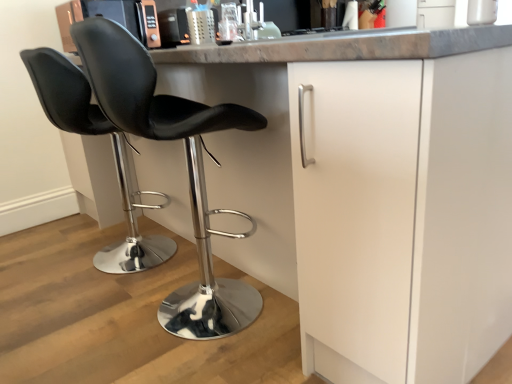
Question: From a real-world perspective, is black leather chair at center, the 2th chair when ordered from right to left, positioned under black leather stool at center, positioned as the 2th chair in left-to-right order, based on gravity?

Choices:
 (A) yes
 (B) no

Answer: (A)

Question: Can you confirm if black leather chair at center, arranged as the first chair when viewed from the left, is smaller than black leather stool at center, which appears as the 1th chair when viewed from the right?

Choices:
 (A) no
 (B) yes

Answer: (B)

Question: Is black leather chair at center, arranged as the first chair when viewed from the left, not close to black leather stool at center, which appears as the 1th chair when viewed from the right?

Choices:
 (A) no
 (B) yes

Answer: (A)

Question: From the image's perspective, is black leather chair at center, arranged as the first chair when viewed from the left, above black leather stool at center, positioned as the 2th chair in left-to-right order?

Choices:
 (A) no
 (B) yes

Answer: (B)

Question: Would you say black leather stool at center, positioned as the 2th chair in left-to-right order, is part of black leather chair at center, arranged as the first chair when viewed from the left,'s contents?

Choices:
 (A) yes
 (B) no

Answer: (B)

Question: Is black leather chair at center, the 2th chair when ordered from right to left, oriented towards black leather stool at center, positioned as the 2th chair in left-to-right order?

Choices:
 (A) no
 (B) yes

Answer: (A)

Question: Is the depth of black leather stool at center, positioned as the 2th chair in left-to-right order, less than that of black leather chair at center, arranged as the first chair when viewed from the left?

Choices:
 (A) yes
 (B) no

Answer: (A)

Question: Can you confirm if black leather stool at center, positioned as the 2th chair in left-to-right order, is positioned to the right of black leather chair at center, arranged as the first chair when viewed from the left?

Choices:
 (A) yes
 (B) no

Answer: (A)

Question: Is black leather stool at center, positioned as the 2th chair in left-to-right order, not within black leather chair at center, arranged as the first chair when viewed from the left?

Choices:
 (A) yes
 (B) no

Answer: (A)

Question: Does black leather stool at center, which appears as the 1th chair when viewed from the right, turn towards black leather chair at center, arranged as the first chair when viewed from the left?

Choices:
 (A) yes
 (B) no

Answer: (B)

Question: Would you consider black leather stool at center, which appears as the 1th chair when viewed from the right, to be distant from black leather chair at center, arranged as the first chair when viewed from the left?

Choices:
 (A) no
 (B) yes

Answer: (A)

Question: Can you confirm if black leather stool at center, which appears as the 1th chair when viewed from the right, is bigger than black leather chair at center, arranged as the first chair when viewed from the left?

Choices:
 (A) yes
 (B) no

Answer: (A)

Question: From the image's perspective, is black leather chair at center, arranged as the first chair when viewed from the left, above or below black leather stool at center, positioned as the 2th chair in left-to-right order?

Choices:
 (A) above
 (B) below

Answer: (A)